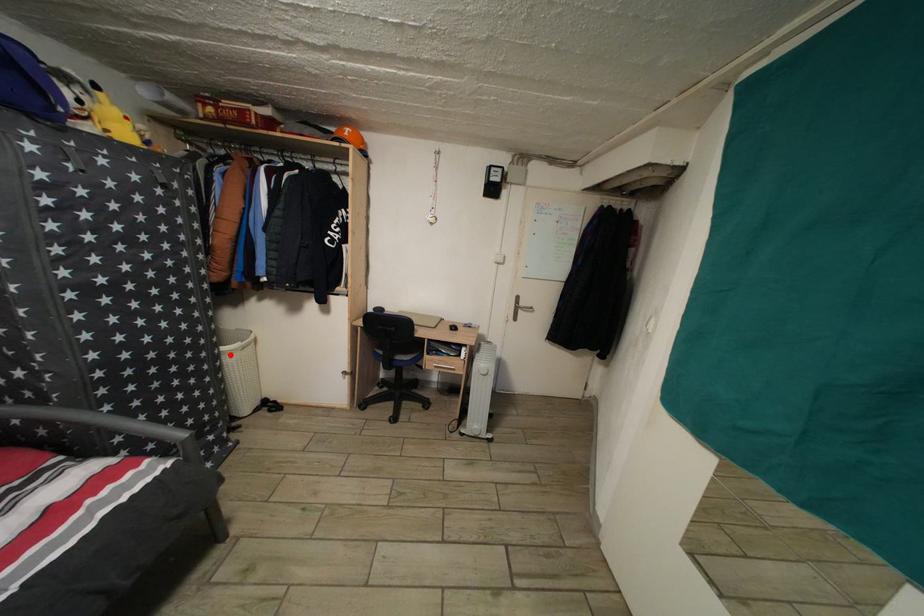
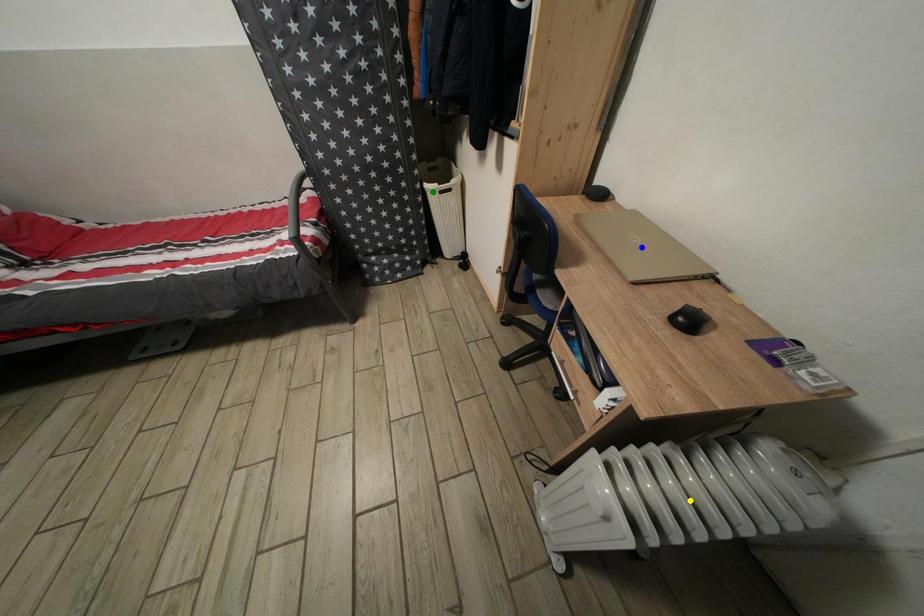
Question: I am providing you with two images of the same scene from different viewpoints. A red point is marked on the first image. You are given multiple points on the second image. Which mark in image 2 goes with the point in image 1?

Choices:
 (A) yellow point
 (B) green point
 (C) blue point

Answer: (B)